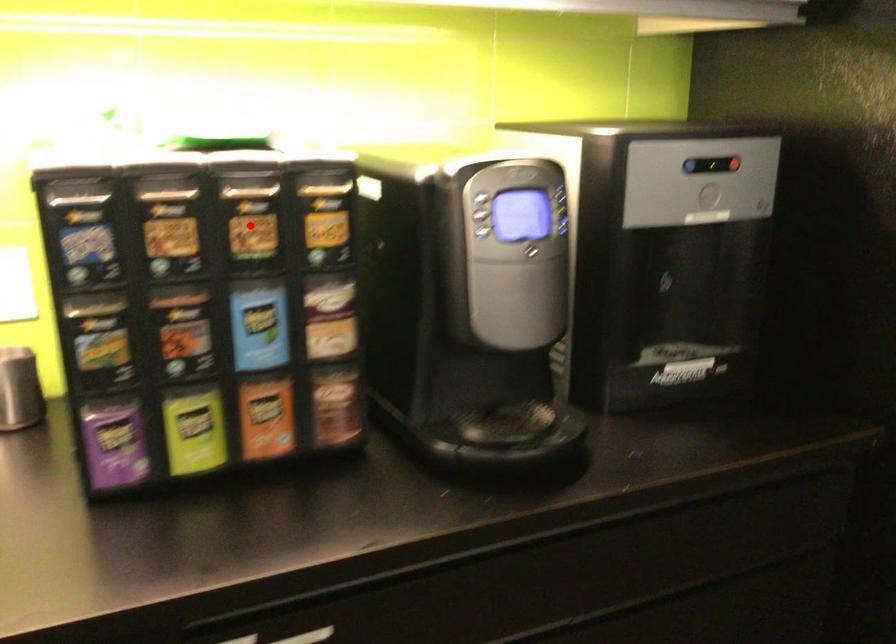
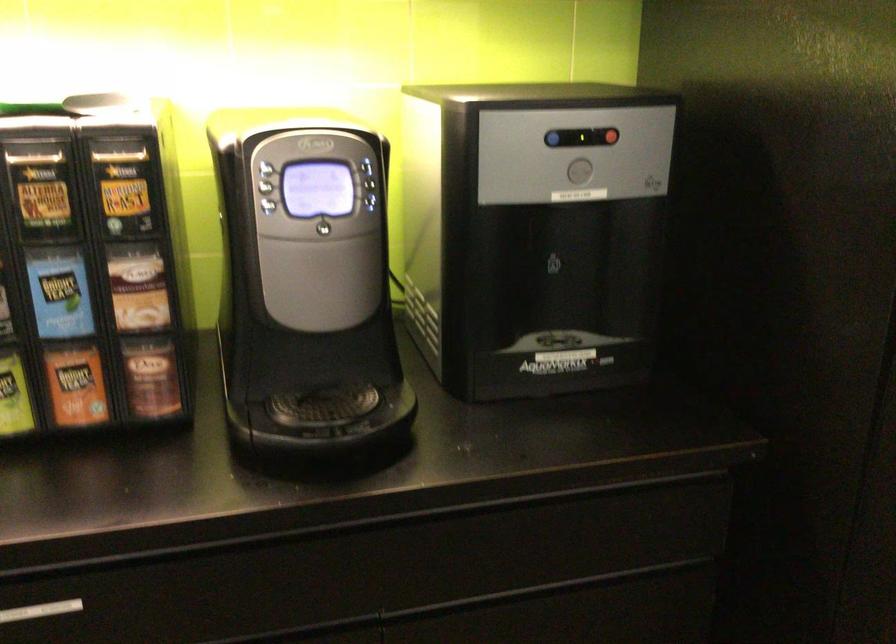
Find the pixel in the second image that matches the highlighted location in the first image.

(41, 191)